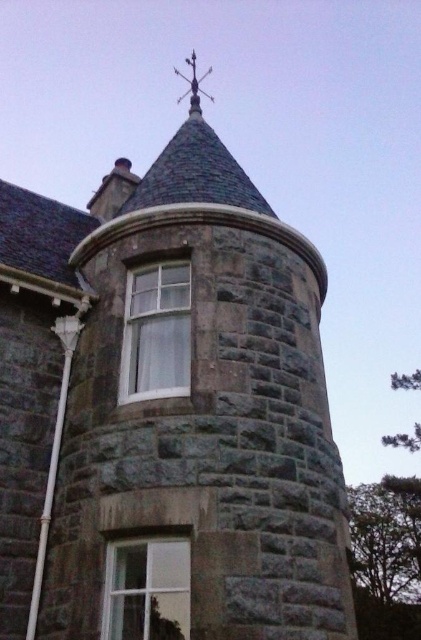
Question: Which object appears farthest from the camera in this image?

Choices:
 (A) clear glass window at center
 (B) white glass window at center

Answer: (B)

Question: Is white glass window at center further to the viewer compared to clear glass window at center?

Choices:
 (A) no
 (B) yes

Answer: (B)

Question: Is white glass window at center below clear glass window at center?

Choices:
 (A) no
 (B) yes

Answer: (A)

Question: Can you confirm if white glass window at center is thinner than clear glass window at center?

Choices:
 (A) yes
 (B) no

Answer: (A)